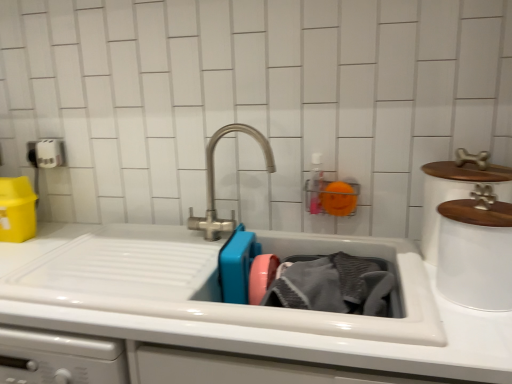
Image resolution: width=512 pixels, height=384 pixels. What do you see at coordinates (214, 184) in the screenshot?
I see `satin nickel faucet at center` at bounding box center [214, 184].

How much space does white matte pet food container at upper right, which ranks as the second appliance in back-to-front order, occupy vertically?

white matte pet food container at upper right, which ranks as the second appliance in back-to-front order, is 9.73 inches tall.

What do you see at coordinates (476, 254) in the screenshot? I see `white matte pet food container at upper right, which ranks as the second appliance in back-to-front order` at bounding box center [476, 254].

You are a GUI agent. You are given a task and a screenshot of the screen. Output one action in this format:
    pyautogui.click(x=<x>, y=<y>)
    Task: Click on the white glossy sink at center
    The image size is (512, 384).
    Given the screenshot: What is the action you would take?
    pyautogui.click(x=267, y=331)

In order to face white matte toilet paper at upper left, should I rotate leftwards or rightwards?

Rotate left and turn 25.942 degrees.

You are a GUI agent. You are given a task and a screenshot of the screen. Output one action in this format:
    pyautogui.click(x=<x>, y=<y>)
    Task: Click on the gray textured towel at sink
    The image size is (512, 384).
    Given the screenshot: What is the action you would take?
    pyautogui.click(x=333, y=285)

Is white glossy sink at center oriented away from gray textured towel at sink?

Yes.

Image resolution: width=512 pixels, height=384 pixels. I want to click on counter top that is above the gray textured towel at sink (from the image's perspective), so click(267, 331).

Considering the relative positions of white glossy sink at center and gray textured towel at sink in the image provided, is white glossy sink at center behind gray textured towel at sink?

That is False.

Which of these two, white glossy sink at center or gray textured towel at sink, is smaller?

gray textured towel at sink is smaller.

From a real-world perspective, is white matte toilet paper at upper left under white matte pet food container at upper right, which ranks as the second appliance in back-to-front order?

Incorrect, from a real-world perspective, white matte toilet paper at upper left is higher than white matte pet food container at upper right, which ranks as the second appliance in back-to-front order.

Is white matte toilet paper at upper left positioned with its back to white matte pet food container at upper right, which is counted as the 1th appliance, starting from the front?

white matte toilet paper at upper left does not have its back to white matte pet food container at upper right, which is counted as the 1th appliance, starting from the front.

Which is closer to the camera, (40, 142) or (506, 277)?

Point (40, 142) is positioned farther from the camera compared to point (506, 277).

Is white matte toilet paper at upper left not within white matte pet food container at upper right, which ranks as the second appliance in back-to-front order?

white matte toilet paper at upper left is positioned outside white matte pet food container at upper right, which ranks as the second appliance in back-to-front order.

Do you think gray textured towel at sink is within white matte toilet paper at upper left, or outside of it?

gray textured towel at sink is not enclosed by white matte toilet paper at upper left.

Considering their positions, is gray textured towel at sink located in front of or behind white matte toilet paper at upper left?

Clearly, gray textured towel at sink is in front of white matte toilet paper at upper left.

From the image's perspective, is gray textured towel at sink located above or below white matte toilet paper at upper left?

From the image's perspective, gray textured towel at sink appears below white matte toilet paper at upper left.

Does gray textured towel at sink have a smaller size compared to white matte toilet paper at upper left?

Actually, gray textured towel at sink might be larger than white matte toilet paper at upper left.

Measure the distance from white matte pet food container at upper right, which is counted as the 1th appliance, starting from the front, to white glossy sink at center.

They are 14.64 inches apart.

Can you confirm if white matte pet food container at upper right, which is counted as the 1th appliance, starting from the front, is taller than white glossy sink at center?

Correct, white matte pet food container at upper right, which is counted as the 1th appliance, starting from the front, is much taller as white glossy sink at center.

Could you tell me if white matte pet food container at upper right, which is counted as the 1th appliance, starting from the front, is facing white glossy sink at center?

No.

Is white matte pet food container at upper right, which is counted as the 1th appliance, starting from the front, at the left side of white glossy sink at center?

No, white matte pet food container at upper right, which is counted as the 1th appliance, starting from the front, is not to the left of white glossy sink at center.

Is white matte pet food container at upper right, which is counted as the 1th appliance, starting from the front, not close to gray textured towel at sink?

No, white matte pet food container at upper right, which is counted as the 1th appliance, starting from the front, is not far away from gray textured towel at sink.

Considering the relative sizes of white matte pet food container at upper right, which ranks as the second appliance in back-to-front order, and gray textured towel at sink in the image provided, is white matte pet food container at upper right, which ranks as the second appliance in back-to-front order, bigger than gray textured towel at sink?

Incorrect, white matte pet food container at upper right, which ranks as the second appliance in back-to-front order, is not larger than gray textured towel at sink.

Is point (470, 216) behind point (346, 309)?

No.

From a real-world perspective, is white matte pet food container at upper right, which is counted as the 1th appliance, starting from the front, located beneath gray textured towel at sink?

Actually, white matte pet food container at upper right, which is counted as the 1th appliance, starting from the front, is physically above gray textured towel at sink in the real world.

Considering their positions, is white ceramic container at upper right, the 1th appliance from the back, located in front of or behind white matte pet food container at upper right, which ranks as the second appliance in back-to-front order?

white ceramic container at upper right, the 1th appliance from the back, is positioned farther from the viewer than white matte pet food container at upper right, which ranks as the second appliance in back-to-front order.

From a real-world perspective, is white ceramic container at upper right, the 1th appliance from the back, physically below white matte pet food container at upper right, which ranks as the second appliance in back-to-front order?

No, from a real-world perspective, white ceramic container at upper right, the 1th appliance from the back, is not below white matte pet food container at upper right, which ranks as the second appliance in back-to-front order.

Considering the sizes of objects white ceramic container at upper right, the 1th appliance from the back, and white matte pet food container at upper right, which is counted as the 1th appliance, starting from the front, in the image provided, who is wider, white ceramic container at upper right, the 1th appliance from the back, or white matte pet food container at upper right, which is counted as the 1th appliance, starting from the front,?

white ceramic container at upper right, the 1th appliance from the back, is wider.

Based on the photo, from the image's perspective, between white ceramic container at upper right, the second appliance when ordered from front to back, and white matte pet food container at upper right, which is counted as the 1th appliance, starting from the front, who is located below?

white matte pet food container at upper right, which is counted as the 1th appliance, starting from the front, is shown below in the image.

From a real-world perspective, is gray textured towel at sink positioned above or below satin nickel faucet at center?

From a real-world perspective, gray textured towel at sink is physically below satin nickel faucet at center.

Is gray textured towel at sink facing away from satin nickel faucet at center?

gray textured towel at sink is not turned away from satin nickel faucet at center.

Who is bigger, gray textured towel at sink or satin nickel faucet at center?

Bigger between the two is gray textured towel at sink.

Between gray textured towel at sink and satin nickel faucet at center, which one has larger width?

gray textured towel at sink.

Find the location of a particular element. The width and height of the screenshot is (512, 384). counter top that is in front of the gray textured towel at sink is located at coordinates (267, 331).

At what (x,y) coordinates should I click in order to perform the action: click on toilet paper on the left of white matte pet food container at upper right, which ranks as the second appliance in back-to-front order. Please return your answer as a coordinate pair (x, y). Looking at the image, I should click on pyautogui.click(x=49, y=153).

Looking at the image, which one is located further to white matte pet food container at upper right, which is counted as the 1th appliance, starting from the front, white ceramic container at upper right, the second appliance when ordered from front to back, or white matte toilet paper at upper left?

Based on the image, white matte toilet paper at upper left appears to be further to white matte pet food container at upper right, which is counted as the 1th appliance, starting from the front.

Estimate the real-world distances between objects in this image. Which object is closer to gray textured towel at sink, white matte toilet paper at upper left or white glossy sink at center?

white glossy sink at center is closer to gray textured towel at sink.

When comparing their distances from white matte toilet paper at upper left, does satin nickel faucet at center or gray textured towel at sink seem closer?

Based on the image, satin nickel faucet at center appears to be nearer to white matte toilet paper at upper left.

Which object lies further to the anchor point white glossy sink at center, satin nickel faucet at center or gray textured towel at sink?

Based on the image, satin nickel faucet at center appears to be further to white glossy sink at center.

Estimate the real-world distances between objects in this image. Which object is closer to white matte pet food container at upper right, which ranks as the second appliance in back-to-front order, gray textured towel at sink or white ceramic container at upper right, the 1th appliance from the back?

Based on the image, white ceramic container at upper right, the 1th appliance from the back, appears to be nearer to white matte pet food container at upper right, which ranks as the second appliance in back-to-front order.

Looking at the image, which one is located further to white matte toilet paper at upper left, satin nickel faucet at center or white matte pet food container at upper right, which ranks as the second appliance in back-to-front order?

white matte pet food container at upper right, which ranks as the second appliance in back-to-front order, is further to white matte toilet paper at upper left.

Considering their positions, is white matte toilet paper at upper left positioned closer to white ceramic container at upper right, the second appliance when ordered from front to back, than gray textured towel at sink?

Among the two, gray textured towel at sink is located nearer to white ceramic container at upper right, the second appliance when ordered from front to back.

Looking at the image, which one is located closer to satin nickel faucet at center, white matte toilet paper at upper left or white ceramic container at upper right, the second appliance when ordered from front to back?

The object closer to satin nickel faucet at center is white ceramic container at upper right, the second appliance when ordered from front to back.

Image resolution: width=512 pixels, height=384 pixels. Find the location of `clothing between white glossy sink at center and satin nickel faucet at center along the z-axis`. clothing between white glossy sink at center and satin nickel faucet at center along the z-axis is located at coordinates (333, 285).

At what (x,y) coordinates should I click in order to perform the action: click on tap located between white glossy sink at center and white matte pet food container at upper right, which ranks as the second appliance in back-to-front order, in the left-right direction. Please return your answer as a coordinate pair (x, y). This screenshot has width=512, height=384. Looking at the image, I should click on (214, 184).

I want to click on counter top between white matte toilet paper at upper left and gray textured towel at sink from left to right, so click(267, 331).

At what (x,y) coordinates should I click in order to perform the action: click on tap between white matte toilet paper at upper left and white ceramic container at upper right, the second appliance when ordered from front to back, from left to right. Please return your answer as a coordinate pair (x, y). The height and width of the screenshot is (384, 512). Looking at the image, I should click on (214, 184).